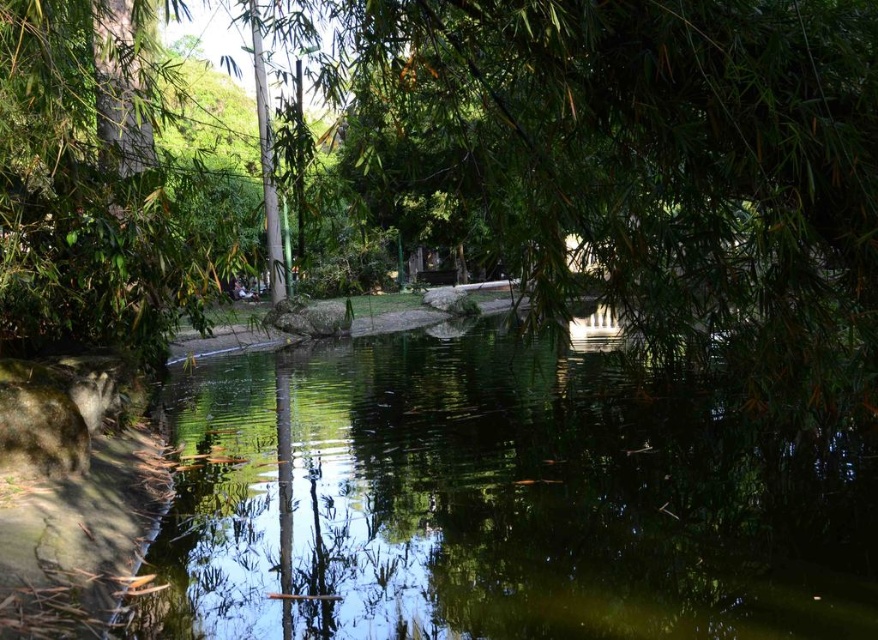
Question: Which point is farther to the camera?

Choices:
 (A) green leafy tree at center
 (B) green reflective water at center

Answer: (A)

Question: Can you confirm if green leafy tree at center is positioned below green reflective water at center?

Choices:
 (A) no
 (B) yes

Answer: (A)

Question: Which point appears farthest from the camera in this image?

Choices:
 (A) 253,454
 (B) 20,106

Answer: (A)

Question: Is green leafy tree at center positioned before green reflective water at center?

Choices:
 (A) no
 (B) yes

Answer: (A)

Question: Is green leafy tree at center thinner than green reflective water at center?

Choices:
 (A) yes
 (B) no

Answer: (B)

Question: Which of the following is the farthest from the observer?

Choices:
 (A) (529, 90)
 (B) (709, 604)

Answer: (A)